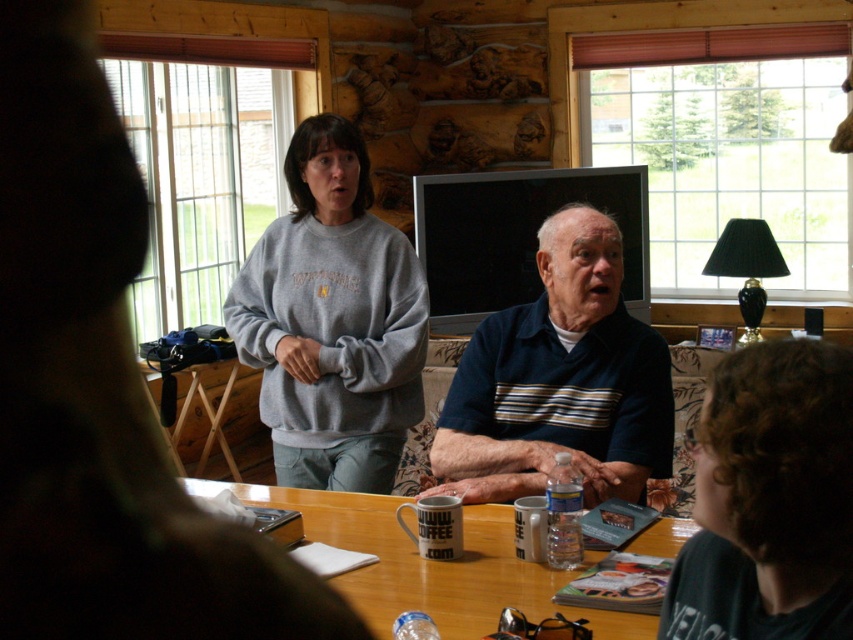
Between point (300, 429) and point (490, 413), which one is positioned in front?

Point (490, 413) is in front.

Which is more to the right, gray sweatshirt at upper left or blue striped polo shirt at center?

blue striped polo shirt at center

Where is `gray sweatshirt at upper left`? Image resolution: width=853 pixels, height=640 pixels. gray sweatshirt at upper left is located at coordinates (332, 321).

Does gray sweatshirt at upper left have a lesser height compared to wooden table at center?

In fact, gray sweatshirt at upper left may be taller than wooden table at center.

Can you confirm if gray sweatshirt at upper left is positioned to the left of wooden table at center?

Yes, gray sweatshirt at upper left is to the left of wooden table at center.

Find the location of a particular element. The width and height of the screenshot is (853, 640). gray sweatshirt at upper left is located at coordinates (332, 321).

This screenshot has width=853, height=640. I want to click on gray sweatshirt at upper left, so click(332, 321).

Measure the distance between blue striped polo shirt at center and wooden table at center.

blue striped polo shirt at center is 16.56 inches away from wooden table at center.

Who is more distant from viewer, [666,420] or [498,598]?

Positioned behind is point [666,420].

Who is more forward, (521, 374) or (415, 557)?

Point (415, 557) is more forward.

This screenshot has width=853, height=640. Identify the location of blue striped polo shirt at center. (560, 381).